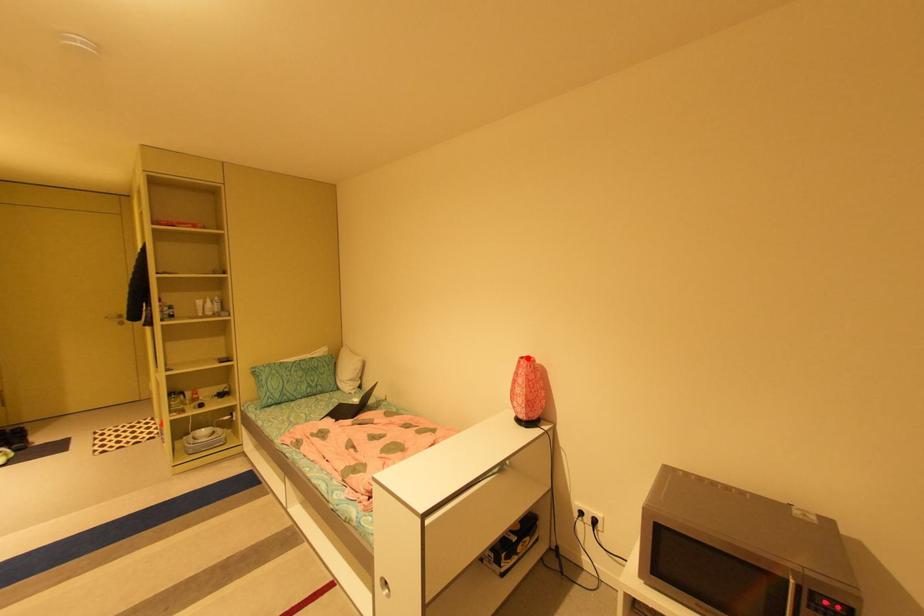
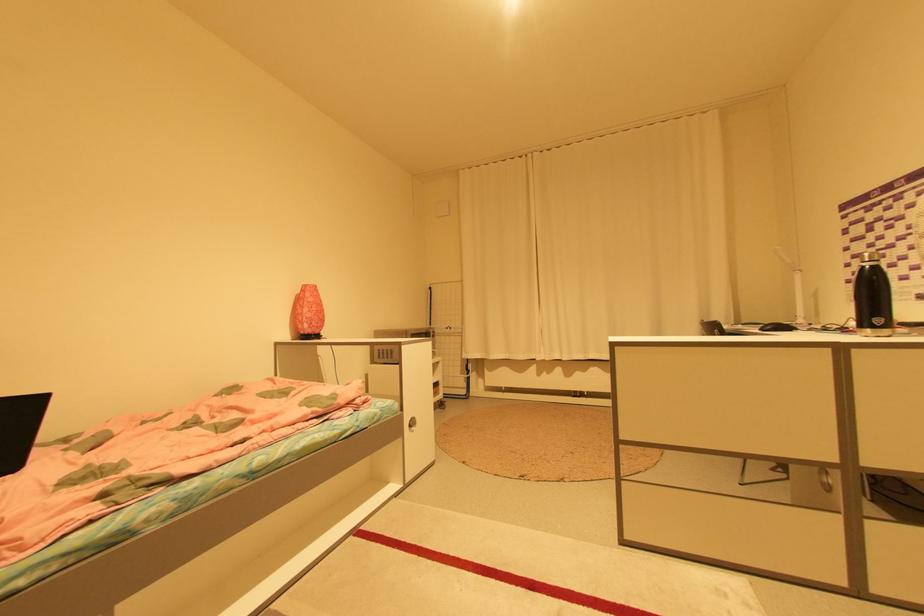
Find the pixel in the second image that matches the highlighted location in the first image.

(311, 285)